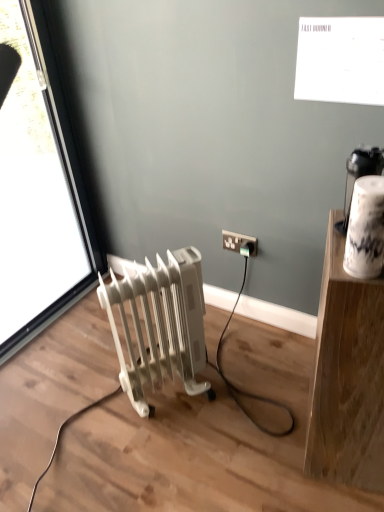
This screenshot has height=512, width=384. What are the coordinates of `vacant area that lies in front of white plastic radiator at lower left` in the screenshot? It's located at tap(172, 459).